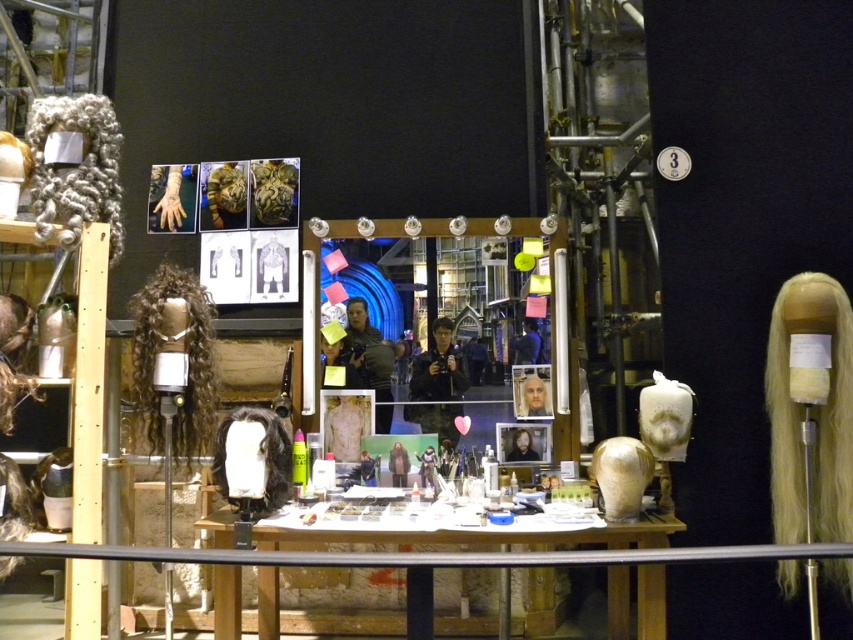
You are an actor preparing for a role and need to locate your wig. You are standing at the wooden table at center. Which direction should you turn to find the blonde synthetic wig at right?

Since the wooden table at center is to the left of the blonde synthetic wig at right, you should turn to your right to face the blonde synthetic wig at right.